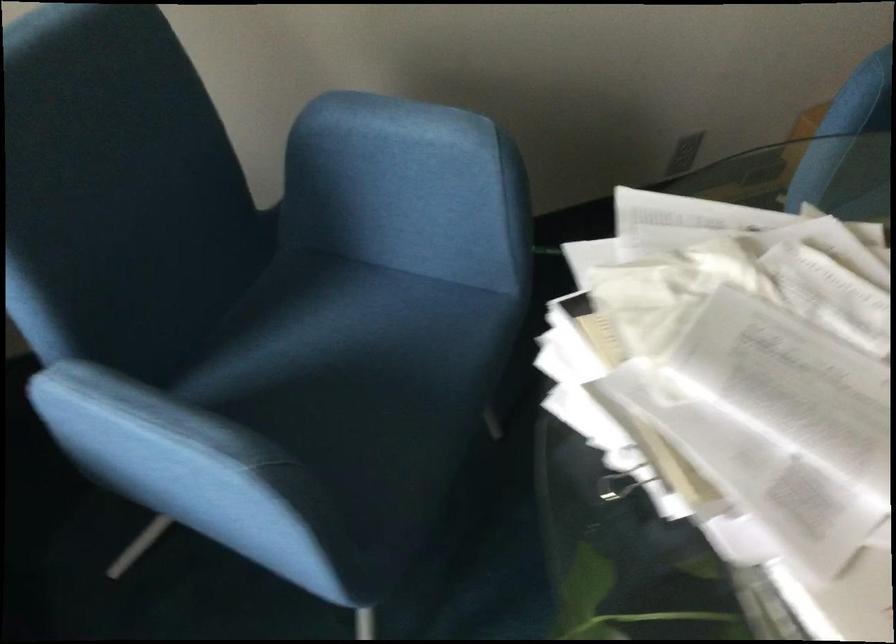
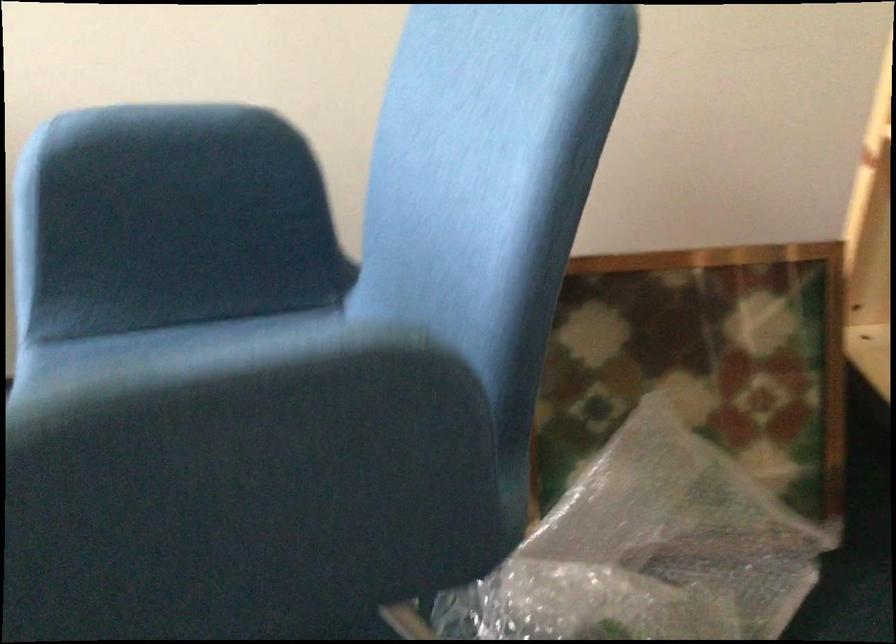
Question: I am providing you with two images of the same scene from different viewpoints. Which of the following objects are not visible in image2?

Choices:
 (A) glass cup
 (B) blue chair sitting surface
 (C) wall electrical outlet
 (D) blue chair armrest

Answer: (C)